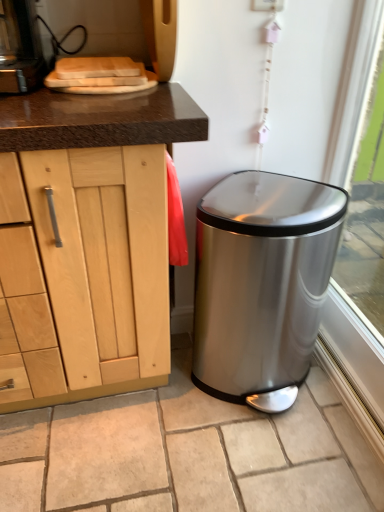
The height and width of the screenshot is (512, 384). What do you see at coordinates (262, 284) in the screenshot?
I see `polished stainless steel trash can at lower right` at bounding box center [262, 284].

In the scene shown: What is the approximate height of transparent glass window at lower right?

transparent glass window at lower right is 3.42 feet in height.

This screenshot has width=384, height=512. Describe the element at coordinates (189, 453) in the screenshot. I see `satin silver trash can at lower right` at that location.

I want to click on polished stainless steel trash can at lower right, so click(x=262, y=284).

Is polished stainless steel trash can at lower right to the right of satin silver trash can at lower right from the viewer's perspective?

Correct, you'll find polished stainless steel trash can at lower right to the right of satin silver trash can at lower right.

Is polished stainless steel trash can at lower right placed right next to satin silver trash can at lower right?

No, polished stainless steel trash can at lower right is not with satin silver trash can at lower right.

From the image's perspective, is polished stainless steel trash can at lower right located above or below satin silver trash can at lower right?

polished stainless steel trash can at lower right is above satin silver trash can at lower right.

From a real-world perspective, is transparent glass window at lower right physically above satin silver trash can at lower right?

Yes, from a real-world perspective, transparent glass window at lower right is above satin silver trash can at lower right.

Who is smaller, transparent glass window at lower right or satin silver trash can at lower right?

Smaller between the two is satin silver trash can at lower right.

Is transparent glass window at lower right in contact with satin silver trash can at lower right?

No, transparent glass window at lower right is not making contact with satin silver trash can at lower right.

Considering the sizes of objects satin silver trash can at lower right and polished stainless steel trash can at lower right in the image provided, who is smaller, satin silver trash can at lower right or polished stainless steel trash can at lower right?

satin silver trash can at lower right is smaller.

Is satin silver trash can at lower right oriented towards polished stainless steel trash can at lower right?

No, satin silver trash can at lower right is not turned towards polished stainless steel trash can at lower right.

Is satin silver trash can at lower right far away from polished stainless steel trash can at lower right?

No.

Which is farther from the camera, (278, 247) or (377, 216)?

Positioned behind is point (377, 216).

Consider the image. How distant is polished stainless steel trash can at lower right from transparent glass window at lower right?

A distance of 15.93 inches exists between polished stainless steel trash can at lower right and transparent glass window at lower right.

Is transparent glass window at lower right located within polished stainless steel trash can at lower right?

No.

This screenshot has width=384, height=512. Identify the location of waste container on the left of transparent glass window at lower right. (262, 284).

From a real-world perspective, between satin silver trash can at lower right and transparent glass window at lower right, who is vertically lower?

In real-world perspective, satin silver trash can at lower right is lower.

Is satin silver trash can at lower right at the right side of transparent glass window at lower right?

Incorrect, satin silver trash can at lower right is not on the right side of transparent glass window at lower right.

At what (x,y) coordinates should I click in order to perform the action: click on granite on the left of the transparent glass window at lower right. Please return your answer as a coordinate pair (x, y). Image resolution: width=384 pixels, height=512 pixels. Looking at the image, I should click on (189, 453).

Which is behind, satin silver trash can at lower right or transparent glass window at lower right?

satin silver trash can at lower right is more distant.

Considering the sizes of objects transparent glass window at lower right and polished stainless steel trash can at lower right in the image provided, who is thinner, transparent glass window at lower right or polished stainless steel trash can at lower right?

transparent glass window at lower right is thinner.

Consider the image. Which of these two, transparent glass window at lower right or polished stainless steel trash can at lower right, is bigger?

polished stainless steel trash can at lower right.

Considering the sizes of objects transparent glass window at lower right and polished stainless steel trash can at lower right in the image provided, who is taller, transparent glass window at lower right or polished stainless steel trash can at lower right?

transparent glass window at lower right.

Can you tell me how much transparent glass window at lower right and polished stainless steel trash can at lower right differ in facing direction?

The angle between the facing direction of transparent glass window at lower right and the facing direction of polished stainless steel trash can at lower right is 88.7 degrees.

At what (x,y) coordinates should I click in order to perform the action: click on granite located on the left of polished stainless steel trash can at lower right. Please return your answer as a coordinate pair (x, y). This screenshot has height=512, width=384. Looking at the image, I should click on (189, 453).

I want to click on window screen that is above the satin silver trash can at lower right (from the image's perspective), so (x=361, y=169).

Which object lies nearer to the anchor point satin silver trash can at lower right, transparent glass window at lower right or polished stainless steel trash can at lower right?

The object closer to satin silver trash can at lower right is polished stainless steel trash can at lower right.

Looking at the image, which one is located closer to satin silver trash can at lower right, polished stainless steel trash can at lower right or transparent glass window at lower right?

Among the two, polished stainless steel trash can at lower right is located nearer to satin silver trash can at lower right.

Considering their positions, is satin silver trash can at lower right positioned further to transparent glass window at lower right than polished stainless steel trash can at lower right?

satin silver trash can at lower right is positioned further to the anchor transparent glass window at lower right.

Based on their spatial positions, is polished stainless steel trash can at lower right or satin silver trash can at lower right closer to transparent glass window at lower right?

polished stainless steel trash can at lower right lies closer to transparent glass window at lower right than the other object.

Considering their positions, is transparent glass window at lower right positioned closer to polished stainless steel trash can at lower right than satin silver trash can at lower right?

The object closer to polished stainless steel trash can at lower right is satin silver trash can at lower right.

Estimate the real-world distances between objects in this image. Which object is further from polished stainless steel trash can at lower right, satin silver trash can at lower right or transparent glass window at lower right?

The object further to polished stainless steel trash can at lower right is transparent glass window at lower right.

I want to click on waste container between transparent glass window at lower right and satin silver trash can at lower right vertically, so click(x=262, y=284).